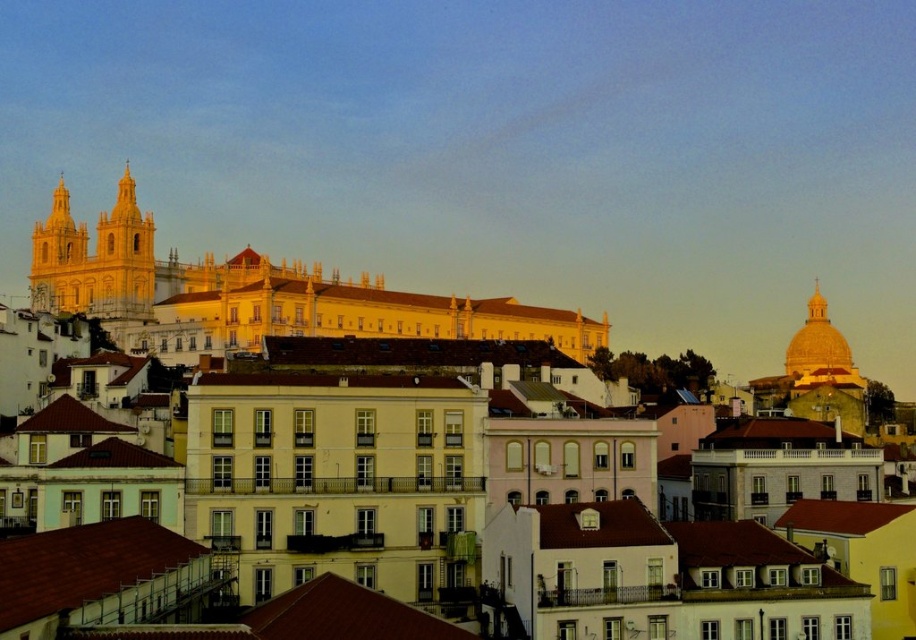
Does golden stone church at left have a greater width compared to golden dome at upper right?

Indeed, golden stone church at left has a greater width compared to golden dome at upper right.

In order to click on golden stone church at left in this screenshot , I will do `click(94, 259)`.

You are a GUI agent. You are given a task and a screenshot of the screen. Output one action in this format:
    pyautogui.click(x=<x>, y=<y>)
    Task: Click on the golden stone church at left
    Image resolution: width=916 pixels, height=640 pixels.
    Given the screenshot: What is the action you would take?
    pyautogui.click(x=94, y=259)